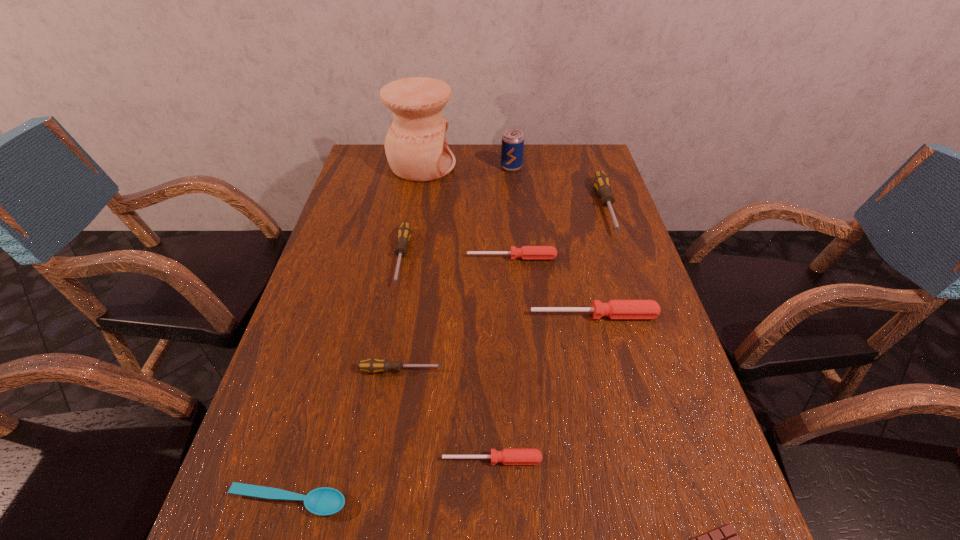
Locate which red screwdriver ranks second in proximity to the spoon. Please provide its 2D coordinates. Your answer should be formatted as a tuple, i.e. [(x, y)], where the tuple contains the x and y coordinates of a point satisfying the conditions above.

[(614, 309)]

Identify which red screwdriver is the closest to the shortest object. Please provide its 2D coordinates. Your answer should be formatted as a tuple, i.e. [(x, y)], where the tuple contains the x and y coordinates of a point satisfying the conditions above.

[(508, 456)]

The height and width of the screenshot is (540, 960). In order to click on vacant space that satisfies the following two spatial constraints: 1. at the open side of the beer can; 2. on the left side of the pottery in this screenshot , I will do `click(421, 167)`.

Locate an element on the screen. Image resolution: width=960 pixels, height=540 pixels. free space that satisfies the following two spatial constraints: 1. at the tip of the second biggest gray screwdriver; 2. on the left side of the shortest screwdriver is located at coordinates (364, 460).

Locate an element on the screen. The width and height of the screenshot is (960, 540). free point that satisfies the following two spatial constraints: 1. on the back side of the biggest red screwdriver; 2. at the open side of the pottery is located at coordinates (559, 165).